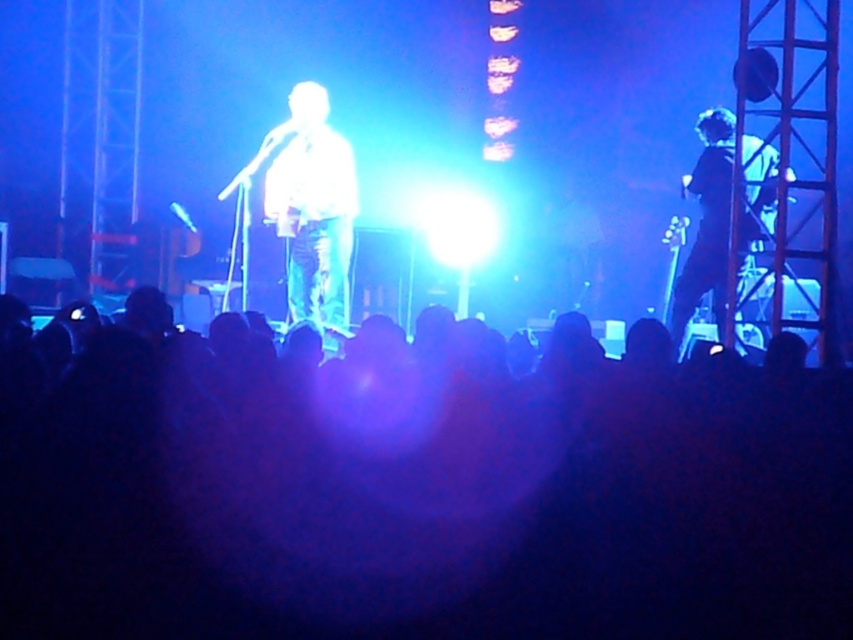
You are a photographer trying to capture a clear shot of both the black matte crowd at center and the dark blue jeans at right. Since you want both subjects in focus, which one should you focus on first to ensure depth of field?

You should focus on the black matte crowd at center first because it is closer to the viewer than the dark blue jeans at right. By focusing on the closer subject, the farther subject will still be within the depth of field range.

You are a photographer trying to capture the musician in the white glossy shirt at center and the dark blue jeans at right. Which object should you focus on first if you want to capture both in the same frame?

The white glossy shirt at center is located above dark blue jeans at right, so you should focus on the white glossy shirt at center first to ensure both are in the frame.

Looking at this image, you are a photographer trying to capture a closeup of the two points in the image. Which point, point (839, 572) or point (318, 154), is closer to your camera lens?

Point (839, 572) is closer to the camera than point (318, 154), so it is closer to the camera lens.